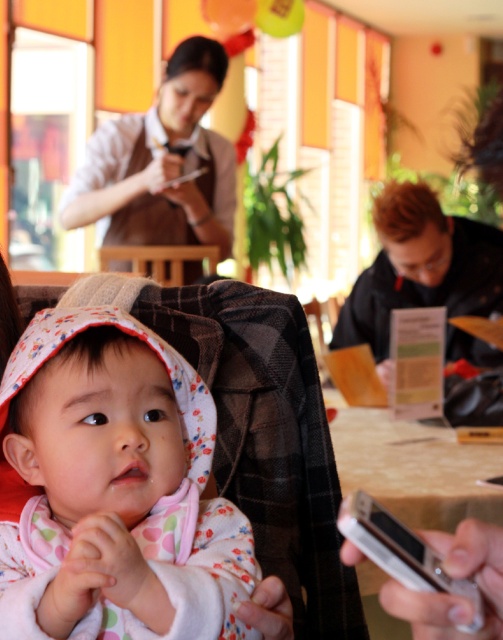
Question: Which point appears farthest from the camera in this image?

Choices:
 (A) (437, 484)
 (B) (149, 429)

Answer: (A)

Question: Is floral fabric baby at center behind white glossy table at lower right?

Choices:
 (A) no
 (B) yes

Answer: (A)

Question: Is floral fabric baby at center thinner than white glossy table at lower right?

Choices:
 (A) no
 (B) yes

Answer: (B)

Question: In this image, where is floral fabric baby at center located relative to white glossy table at lower right?

Choices:
 (A) left
 (B) right

Answer: (A)